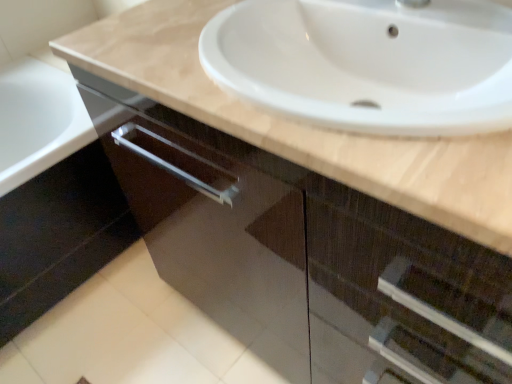
Question: Should I look upward or downward to see white glossy tile at lower left?

Choices:
 (A) down
 (B) up

Answer: (A)